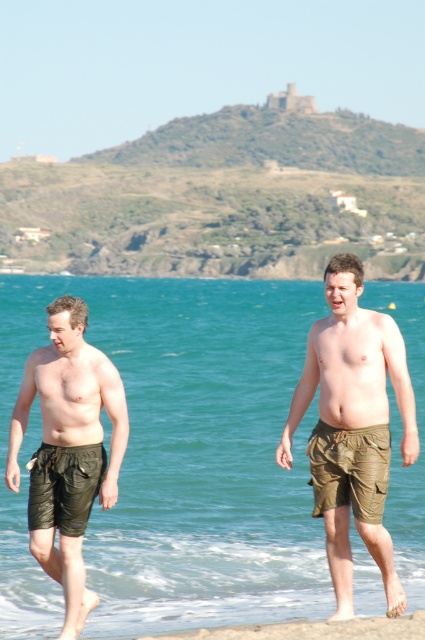
Question: Is the position of green fabric shorts at center less distant than that of green leather shorts at lower left?

Choices:
 (A) no
 (B) yes

Answer: (A)

Question: Which is farther from the green leather shorts at lower left?

Choices:
 (A) green fabric shorts at center
 (B) matte khaki shorts at center

Answer: (A)

Question: Among these objects, which one is nearest to the camera?

Choices:
 (A) matte olive green swim shorts at left
 (B) matte khaki shorts at center

Answer: (A)

Question: Which point is closer to the camera?

Choices:
 (A) (74, 492)
 (B) (53, 419)

Answer: (A)

Question: In this image, where is green fabric shorts at center located relative to green leather shorts at lower left?

Choices:
 (A) below
 (B) above

Answer: (B)

Question: Is green fabric shorts at center closer to the viewer compared to matte olive green swim shorts at left?

Choices:
 (A) no
 (B) yes

Answer: (A)